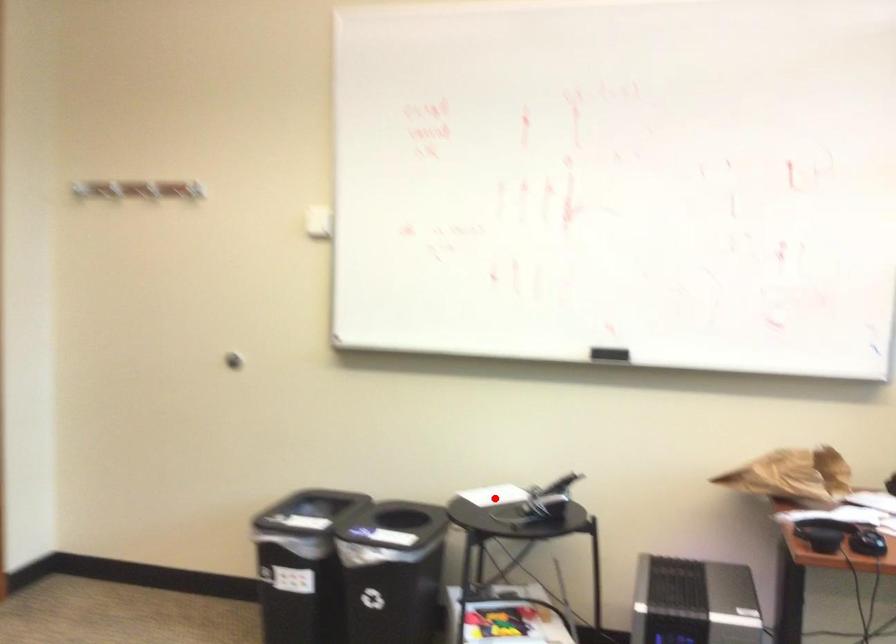
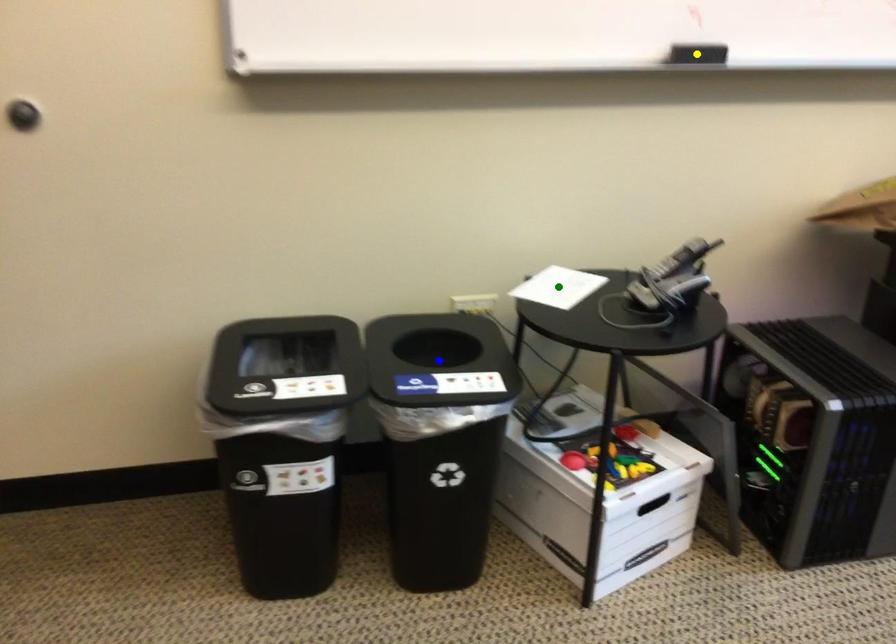
Question: I am providing you with two images of the same scene from different viewpoints. A red point is marked on the first image. You are given multiple points on the second image. Can you choose the point in image 2 that corresponds to the point in image 1?

Choices:
 (A) yellow point
 (B) blue point
 (C) green point

Answer: (C)